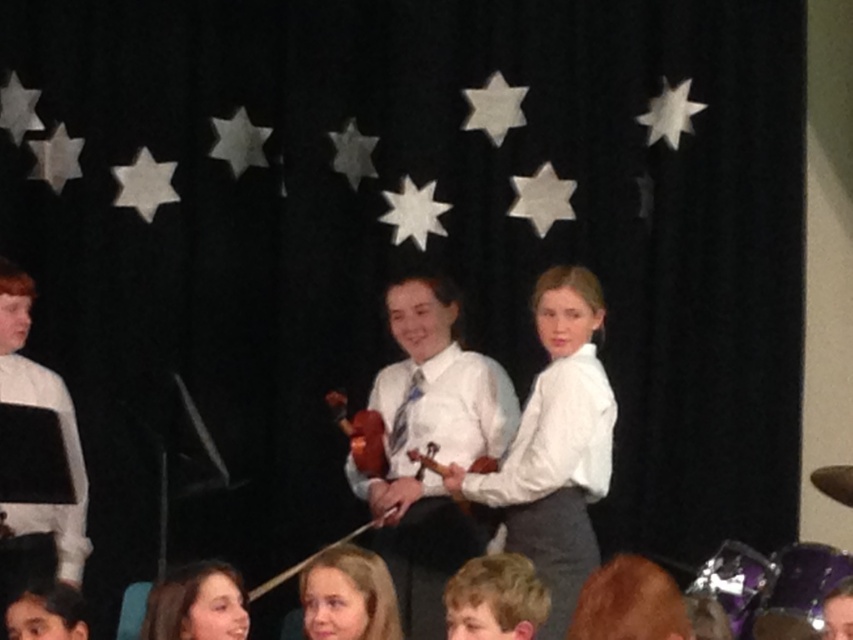
Question: Which of the following is the farthest from the observer?

Choices:
 (A) white striped shirt at left
 (B) wooden violin at center
 (C) white glossy shirt at center
 (D) light brown hair at lower center

Answer: (B)

Question: Which is farther from the shiny black hair at center?

Choices:
 (A) white glossy shirt at center
 (B) smooth blonde hair at lower center
 (C) light brown hair at lower center

Answer: (A)

Question: Can you confirm if smooth blonde hair at lower center is smaller than smooth brown hair at lower left?

Choices:
 (A) no
 (B) yes

Answer: (A)

Question: Estimate the real-world distances between objects in this image. Which object is farther from the shiny black hair at center?

Choices:
 (A) wooden violin at center
 (B) white striped shirt at left
 (C) smooth blonde hair at lower center
 (D) white glossy shirt at center

Answer: (B)

Question: Does white satin blouse at center appear under white striped shirt at left?

Choices:
 (A) yes
 (B) no

Answer: (A)

Question: Is smooth brown hair at lower left smaller than shiny black hair at center?

Choices:
 (A) yes
 (B) no

Answer: (B)